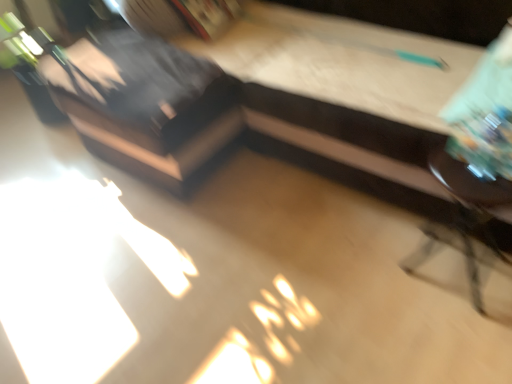
Where is `free space to the left of metallic dark brown swivel chair at right`? free space to the left of metallic dark brown swivel chair at right is located at coordinates (380, 279).